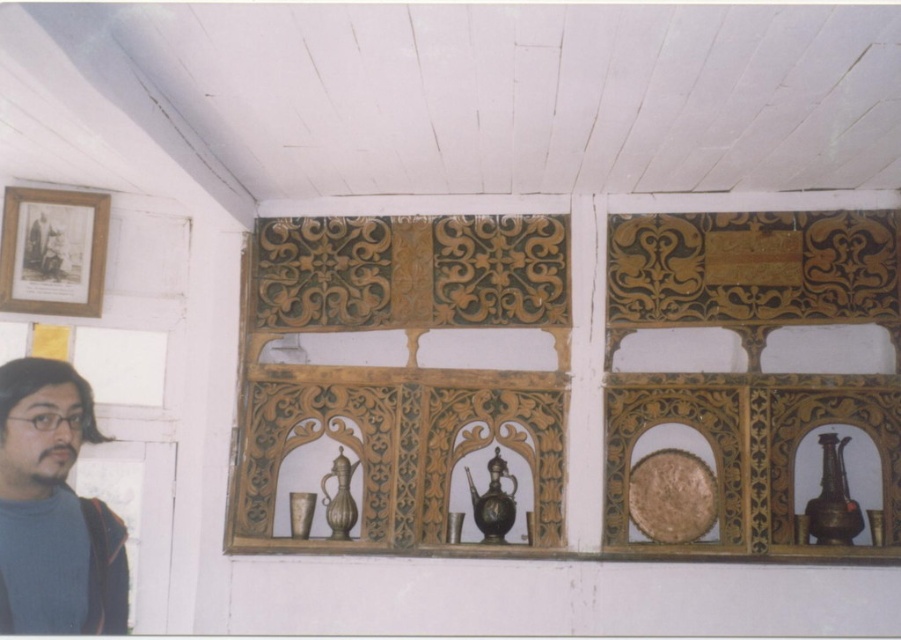
From the picture: You are a delivery person who needs to place a package that is 5 feet long between the bronze metallic vase at right and the shiny bronze vase at center. Can you fit the package between them without moving either vase?

The distance between the bronze metallic vase at right and the shiny bronze vase at center is 4.71 feet, which is shorter than the 5 feet length of the package. Therefore, the package cannot fit between them without moving either vase.

You are an interior designer assessing the placement of the bronze metallic vase at right and the shiny brass vase at center on the decorative wooden panel. Which vase is taller?

The bronze metallic vase at right is taller than the shiny brass vase at center.